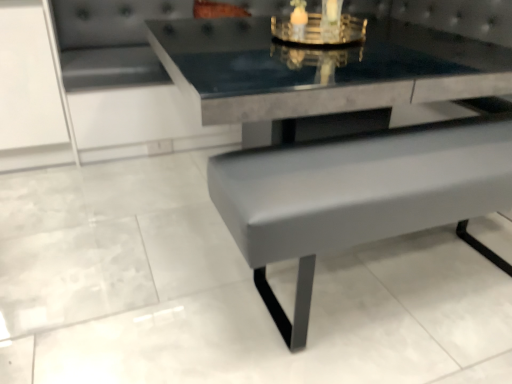
Describe the element at coordinates (320, 26) in the screenshot. The height and width of the screenshot is (384, 512). I see `gold metallic candle holder at upper center` at that location.

Identify the location of gold metallic candle holder at upper center. (320, 26).

Describe the element at coordinates (342, 139) in the screenshot. I see `matte gray bench at lower right` at that location.

At what (x,y) coordinates should I click in order to perform the action: click on matte gray bench at lower right. Please return your answer as a coordinate pair (x, y). The image size is (512, 384). Looking at the image, I should click on (342, 139).

Measure the distance between point (287,178) and camera.

Point (287,178) and camera are 1.13 meters apart from each other.

Find the location of `gold metallic candle holder at upper center`. gold metallic candle holder at upper center is located at coordinates (320, 26).

Would you say gold metallic candle holder at upper center is to the left or to the right of matte gray bench at lower right in the picture?

From the image, it's evident that gold metallic candle holder at upper center is to the left of matte gray bench at lower right.

Considering their positions, is gold metallic candle holder at upper center located in front of or behind matte gray bench at lower right?

gold metallic candle holder at upper center is behind matte gray bench at lower right.

Considering the positions of points (362, 19) and (444, 127), is point (362, 19) farther from camera compared to point (444, 127)?

Yes, it is behind point (444, 127).

From the image's perspective, is gold metallic candle holder at upper center positioned above or below matte gray bench at lower right?

From the image's perspective, gold metallic candle holder at upper center appears above matte gray bench at lower right.

From a real-world perspective, which object stands above the other?

In real-world perspective, gold metallic candle holder at upper center is above.

Is gold metallic candle holder at upper center wider or thinner than matte gray bench at lower right?

In the image, gold metallic candle holder at upper center appears to be more narrow than matte gray bench at lower right.

Consider the image. Can you confirm if gold metallic candle holder at upper center is shorter than matte gray bench at lower right?

Indeed, gold metallic candle holder at upper center has a lesser height compared to matte gray bench at lower right.

Is gold metallic candle holder at upper center smaller than matte gray bench at lower right?

Indeed, gold metallic candle holder at upper center has a smaller size compared to matte gray bench at lower right.

Is gold metallic candle holder at upper center inside or outside of matte gray bench at lower right?

gold metallic candle holder at upper center exists outside the volume of matte gray bench at lower right.

Is gold metallic candle holder at upper center far from matte gray bench at lower right?

No, gold metallic candle holder at upper center is not far away from matte gray bench at lower right.

Could you tell me if gold metallic candle holder at upper center is facing matte gray bench at lower right?

No, gold metallic candle holder at upper center is not aimed at matte gray bench at lower right.

Where is `picnic table lying in front of the gold metallic candle holder at upper center`? Image resolution: width=512 pixels, height=384 pixels. picnic table lying in front of the gold metallic candle holder at upper center is located at coordinates (342, 139).

Visually, is matte gray bench at lower right positioned to the left or to the right of gold metallic candle holder at upper center?

Clearly, matte gray bench at lower right is on the right of gold metallic candle holder at upper center in the image.

Does matte gray bench at lower right lie in front of gold metallic candle holder at upper center?

Yes, it is in front of gold metallic candle holder at upper center.

From the picture: Which point is more distant from viewer, (458, 83) or (315, 24)?

The point (315, 24) is farther.

Looking at this image, from the image's perspective, is matte gray bench at lower right located above gold metallic candle holder at upper center?

No, from the image's perspective, matte gray bench at lower right is not above gold metallic candle holder at upper center.

From a real-world perspective, who is located lower, matte gray bench at lower right or gold metallic candle holder at upper center?

matte gray bench at lower right is physically lower.

Between matte gray bench at lower right and gold metallic candle holder at upper center, which one has larger width?

With larger width is matte gray bench at lower right.

Looking at this image, in terms of height, does matte gray bench at lower right look taller or shorter compared to gold metallic candle holder at upper center?

In the image, matte gray bench at lower right appears to be taller than gold metallic candle holder at upper center.

Which of these two, matte gray bench at lower right or gold metallic candle holder at upper center, is bigger?

Bigger between the two is matte gray bench at lower right.

Is matte gray bench at lower right surrounding gold metallic candle holder at upper center?

Definitely not — gold metallic candle holder at upper center is not inside matte gray bench at lower right.

Would you say matte gray bench at lower right is a long distance from gold metallic candle holder at upper center?

No, matte gray bench at lower right is in close proximity to gold metallic candle holder at upper center.

Could you tell me if matte gray bench at lower right is facing gold metallic candle holder at upper center?

No, matte gray bench at lower right is not turned towards gold metallic candle holder at upper center.

How distant is matte gray bench at lower right from gold metallic candle holder at upper center?

matte gray bench at lower right and gold metallic candle holder at upper center are 15.70 inches apart from each other.

Find the location of `candle holder located above the matte gray bench at lower right (from a real-world perspective)`. candle holder located above the matte gray bench at lower right (from a real-world perspective) is located at coordinates (320, 26).

The width and height of the screenshot is (512, 384). In order to click on candle holder that appears on the left of matte gray bench at lower right in this screenshot , I will do pos(320,26).

Image resolution: width=512 pixels, height=384 pixels. Find the location of `candle holder above the matte gray bench at lower right (from a real-world perspective)`. candle holder above the matte gray bench at lower right (from a real-world perspective) is located at coordinates (320, 26).